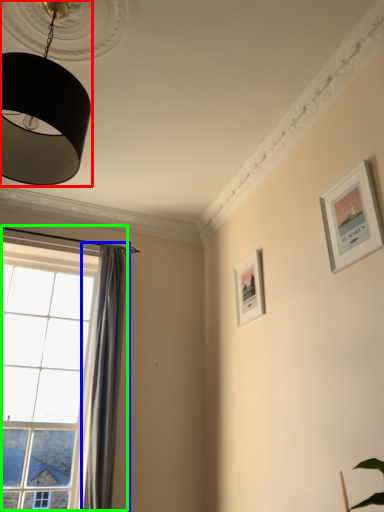
Question: Which is nearer to the lamp (highlighted by a red box)? curtain (highlighted by a blue box) or window (highlighted by a green box).

Choices:
 (A) curtain
 (B) window

Answer: (B)